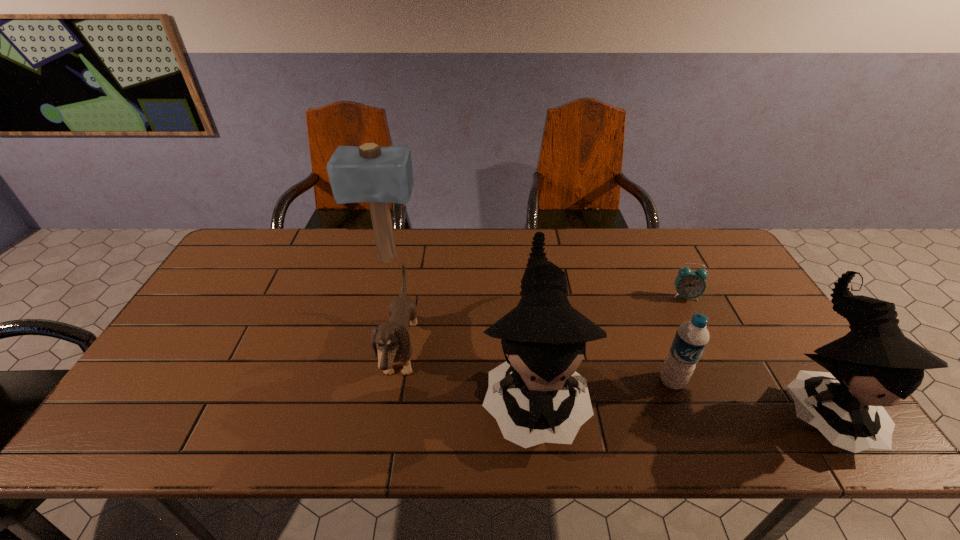
I want to click on vacant space located 0.200m on the right of the mallet, so click(480, 259).

The height and width of the screenshot is (540, 960). In order to click on vacant region located on the face of the second object from right to left in this screenshot , I will do `click(704, 333)`.

Locate an element on the screen. The image size is (960, 540). vacant space located at the face of the puppy is located at coordinates (506, 353).

Image resolution: width=960 pixels, height=540 pixels. I want to click on object that is at the far edge, so click(369, 173).

Identify the location of water bottle at the near edge. (692, 337).

Find the location of a particular element. The height and width of the screenshot is (540, 960). puppy at the near edge is located at coordinates (392, 339).

At what (x,y) coordinates should I click in order to perform the action: click on object located at the right edge. Please return your answer as a coordinate pair (x, y). Looking at the image, I should click on coord(874,365).

The image size is (960, 540). Find the location of `object located in the near right corner section of the desktop`. object located in the near right corner section of the desktop is located at coordinates (874, 365).

Locate an element on the screen. The width and height of the screenshot is (960, 540). free spot at the far edge of the desktop is located at coordinates (499, 266).

Identify the location of free region at the near edge. The image size is (960, 540). (652, 393).